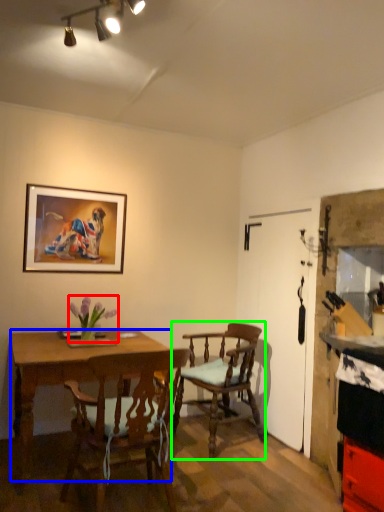
Question: Considering the real-world distances, which object is farthest from flower (highlighted by a red box)? desk (highlighted by a blue box) or chair (highlighted by a green box)?

Choices:
 (A) desk
 (B) chair

Answer: (B)